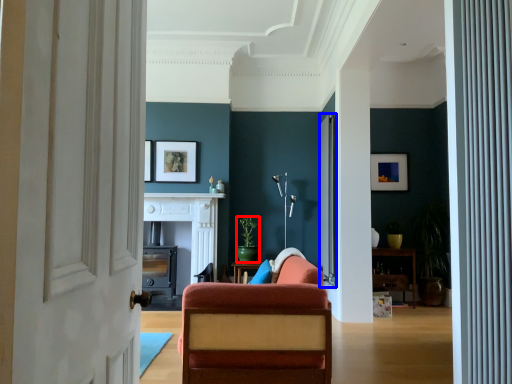
Question: Which object is closer to the camera taking this photo, houseplant (highlighted by a red box) or screen door (highlighted by a blue box)?

Choices:
 (A) houseplant
 (B) screen door

Answer: (B)